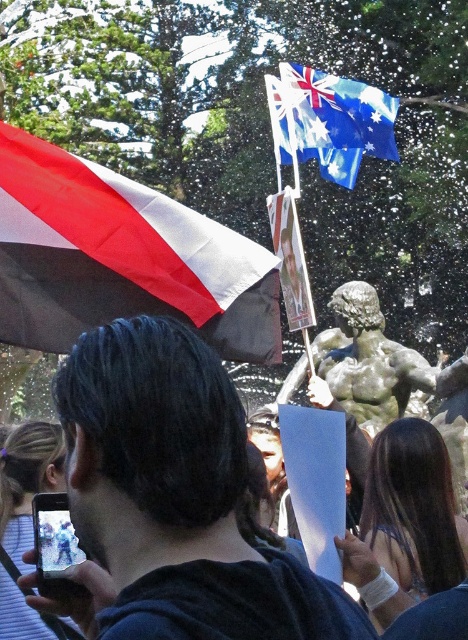
Question: Can you confirm if red and white striped flag at upper left is thinner than blue fabric flag at upper center?

Choices:
 (A) no
 (B) yes

Answer: (A)

Question: Which object is the farthest from the dark blue fabric at center?

Choices:
 (A) red and white striped flag at upper left
 (B) blue fabric flag at upper center

Answer: (B)

Question: Does dark blue fabric at center appear on the right side of red and white striped flag at upper left?

Choices:
 (A) no
 (B) yes

Answer: (B)

Question: From the image, what is the correct spatial relationship of dark blue fabric at center in relation to red and white striped flag at upper left?

Choices:
 (A) below
 (B) above

Answer: (A)

Question: Which object is the farthest from the dark blue fabric at center?

Choices:
 (A) blue fabric flag at upper center
 (B) red and white striped flag at upper left

Answer: (A)

Question: Which object appears farthest from the camera in this image?

Choices:
 (A) dark blue fabric at center
 (B) red and white striped flag at upper left
 (C) blue fabric flag at upper center

Answer: (C)